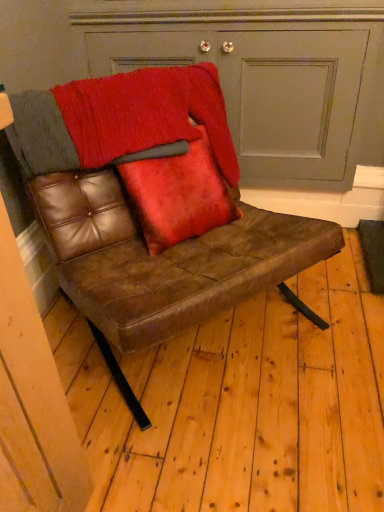
Locate an element on the screen. velvet red pillow at center is located at coordinates (179, 194).

What do you see at coordinates (179, 194) in the screenshot? I see `velvet red pillow at center` at bounding box center [179, 194].

Measure the distance between point (205, 38) and camera.

5.51 feet.

The image size is (384, 512). I want to click on matte gray door at upper center, so click(x=269, y=93).

What is the approximate width of textured wool blanket at upper center?

9.87 inches.

At what (x,y) coordinates should I click in order to perform the action: click on velvet red pillow at center. Please return your answer as a coordinate pair (x, y). This screenshot has height=512, width=384. Looking at the image, I should click on (179, 194).

Does brown leather chair at center turn towards textured wool blanket at upper center?

No, brown leather chair at center is not aimed at textured wool blanket at upper center.

Is point (165, 76) positioned before point (26, 144)?

No, it is not.

Is brown leather chair at center placed right next to textured wool blanket at upper center?

No, brown leather chair at center is not beside textured wool blanket at upper center.

Can you confirm if brown leather chair at center is positioned to the right of textured wool blanket at upper center?

Indeed, brown leather chair at center is positioned on the right side of textured wool blanket at upper center.

Is velvet red pillow at center positioned in front of brown leather chair at center?

That is False.

Could you tell me if velvet red pillow at center is turned towards brown leather chair at center?

Yes, velvet red pillow at center is facing brown leather chair at center.

Considering the sizes of objects velvet red pillow at center and brown leather chair at center in the image provided, who is shorter, velvet red pillow at center or brown leather chair at center?

Standing shorter between the two is velvet red pillow at center.

From a real-world perspective, is velvet red pillow at center located higher than brown leather chair at center?

Yes.

From a real-world perspective, is matte gray door at upper center on brown leather chair at center?

Indeed, from a real-world perspective, matte gray door at upper center stands above brown leather chair at center.

How many degrees apart are the facing directions of matte gray door at upper center and brown leather chair at center?

46 degrees.

How distant is matte gray door at upper center from brown leather chair at center?

matte gray door at upper center is 23.14 inches from brown leather chair at center.

Does matte gray door at upper center turn towards brown leather chair at center?

Yes, matte gray door at upper center is oriented towards brown leather chair at center.

Is brown leather chair at center facing away from matte gray door at upper center?

No, brown leather chair at center's orientation is not away from matte gray door at upper center.

Is brown leather chair at center not close to matte gray door at upper center?

That's not correct — brown leather chair at center is a little close to matte gray door at upper center.

Can you tell me how much brown leather chair at center and matte gray door at upper center differ in facing direction?

brown leather chair at center and matte gray door at upper center are facing 46 degrees away from each other.

Can you confirm if brown leather chair at center is taller than matte gray door at upper center?

No, brown leather chair at center is not taller than matte gray door at upper center.

Is textured wool blanket at upper center wider or thinner than velvet red pillow at center?

Considering their sizes, textured wool blanket at upper center looks broader than velvet red pillow at center.

Is textured wool blanket at upper center far from velvet red pillow at center?

That's not correct — textured wool blanket at upper center is a little close to velvet red pillow at center.

In the scene shown: Is textured wool blanket at upper center positioned with its back to velvet red pillow at center?

Absolutely, textured wool blanket at upper center is directed away from velvet red pillow at center.

Is brown leather chair at center positioned with its back to velvet red pillow at center?

Yes, brown leather chair at center's orientation is away from velvet red pillow at center.

Does brown leather chair at center have a lesser height compared to velvet red pillow at center?

In fact, brown leather chair at center may be taller than velvet red pillow at center.

From the image's perspective, is brown leather chair at center above or below velvet red pillow at center?

brown leather chair at center is situated lower than velvet red pillow at center in the image.

Which point is more forward, (47, 238) or (182, 201)?

The point (182, 201) is closer.

Between matte gray door at upper center and velvet red pillow at center, which one has larger size?

Bigger between the two is matte gray door at upper center.

Is matte gray door at upper center situated inside velvet red pillow at center or outside?

matte gray door at upper center is spatially situated outside velvet red pillow at center.

How distant is matte gray door at upper center from velvet red pillow at center?

matte gray door at upper center and velvet red pillow at center are 57.97 centimeters apart from each other.

I want to click on throw pillow on the left of matte gray door at upper center, so click(179, 194).

Where is `blanket on the left side of brown leather chair at center`? blanket on the left side of brown leather chair at center is located at coordinates (121, 119).

This screenshot has height=512, width=384. In order to click on throw pillow on the right of brown leather chair at center in this screenshot , I will do [179, 194].

Which object lies further to the anchor point textured wool blanket at upper center, velvet red pillow at center or matte gray door at upper center?

matte gray door at upper center is further to textured wool blanket at upper center.

Looking at the image, which one is located further to velvet red pillow at center, brown leather chair at center or matte gray door at upper center?

matte gray door at upper center.

When comparing their distances from brown leather chair at center, does textured wool blanket at upper center or velvet red pillow at center seem further?

textured wool blanket at upper center.

Considering their positions, is textured wool blanket at upper center positioned closer to velvet red pillow at center than matte gray door at upper center?

textured wool blanket at upper center.

Consider the image. Looking at the image, which one is located closer to brown leather chair at center, textured wool blanket at upper center or matte gray door at upper center?

textured wool blanket at upper center is closer to brown leather chair at center.

Which object lies further to the anchor point brown leather chair at center, velvet red pillow at center or textured wool blanket at upper center?

textured wool blanket at upper center.

Based on their spatial positions, is matte gray door at upper center or velvet red pillow at center closer to brown leather chair at center?

velvet red pillow at center.

When comparing their distances from textured wool blanket at upper center, does brown leather chair at center or velvet red pillow at center seem further?

velvet red pillow at center is positioned further to the anchor textured wool blanket at upper center.

Where is `blanket between matte gray door at upper center and velvet red pillow at center from top to bottom`? This screenshot has width=384, height=512. blanket between matte gray door at upper center and velvet red pillow at center from top to bottom is located at coordinates (121, 119).

Identify the location of throw pillow located between brown leather chair at center and matte gray door at upper center in the depth direction. [179, 194].

Image resolution: width=384 pixels, height=512 pixels. I want to click on blanket positioned between brown leather chair at center and matte gray door at upper center from near to far, so click(121, 119).

Where is `blanket located between brown leather chair at center and velvet red pillow at center in the depth direction`? This screenshot has height=512, width=384. blanket located between brown leather chair at center and velvet red pillow at center in the depth direction is located at coordinates (121, 119).